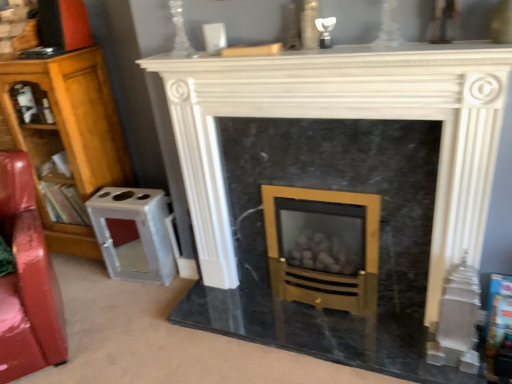
Find the location of a particular element. free spot to the right of glossy red swivel chair at left is located at coordinates (129, 325).